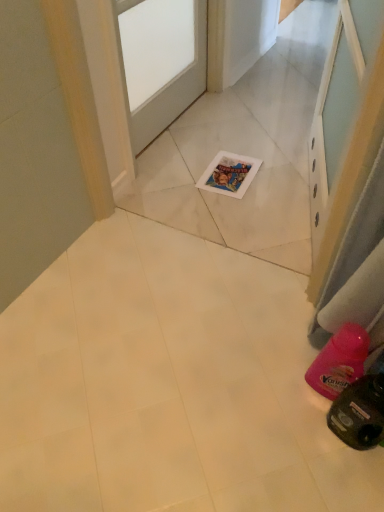
Locate an element on the screen. vacant area to the left of clear glass screen door at upper center is located at coordinates (233, 194).